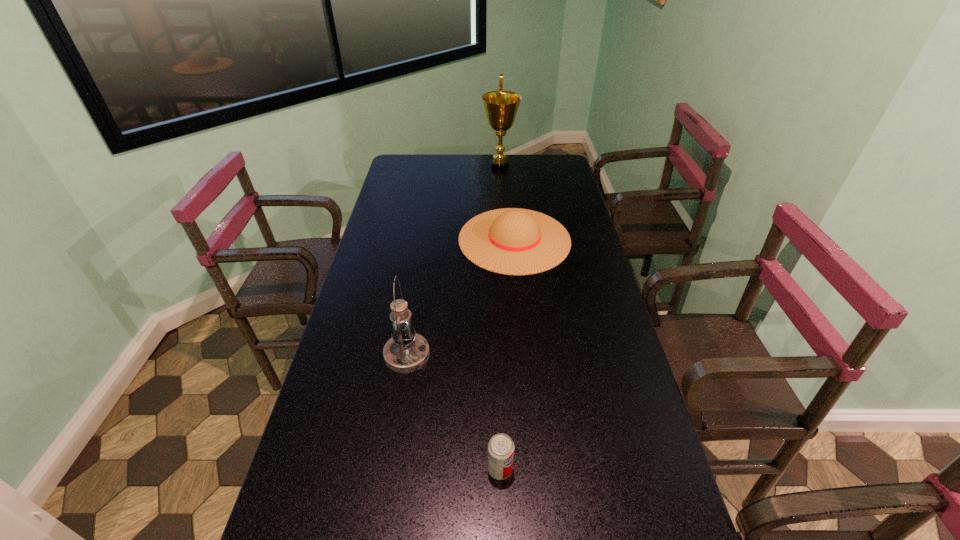
At what (x,y) coordinates should I click in order to perform the action: click on vacant space positioned 0.100m on the left of the third nearest object. Please return your answer as a coordinate pair (x, y). The width and height of the screenshot is (960, 540). Looking at the image, I should click on (432, 240).

At what (x,y) coordinates should I click in order to perform the action: click on vacant space located on the back of the nearest object. Please return your answer as a coordinate pair (x, y). The height and width of the screenshot is (540, 960). Looking at the image, I should click on (499, 436).

Image resolution: width=960 pixels, height=540 pixels. Identify the location of object present at the far edge. (501, 107).

This screenshot has width=960, height=540. I want to click on object that is at the left edge, so click(x=406, y=352).

Where is `object located in the right edge section of the desktop`? This screenshot has width=960, height=540. object located in the right edge section of the desktop is located at coordinates (511, 241).

Locate an element on the screen. vacant region at the far edge of the desktop is located at coordinates (500, 175).

What are the coordinates of `vacant position at the left edge of the desktop` in the screenshot? It's located at (412, 186).

At what (x,y) coordinates should I click in order to perform the action: click on vacant region at the right edge of the desktop. Please return your answer as a coordinate pair (x, y). Looking at the image, I should click on (592, 285).

Image resolution: width=960 pixels, height=540 pixels. Find the location of `free space at the far left corner`. free space at the far left corner is located at coordinates (414, 157).

This screenshot has height=540, width=960. In order to click on vacant area between the bonnet and the farthest object in this screenshot , I will do `click(507, 203)`.